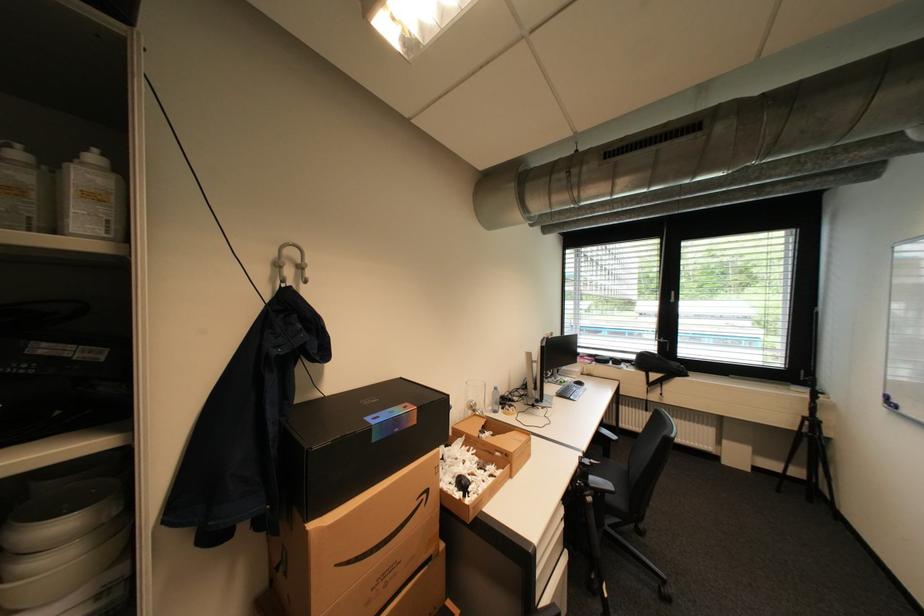
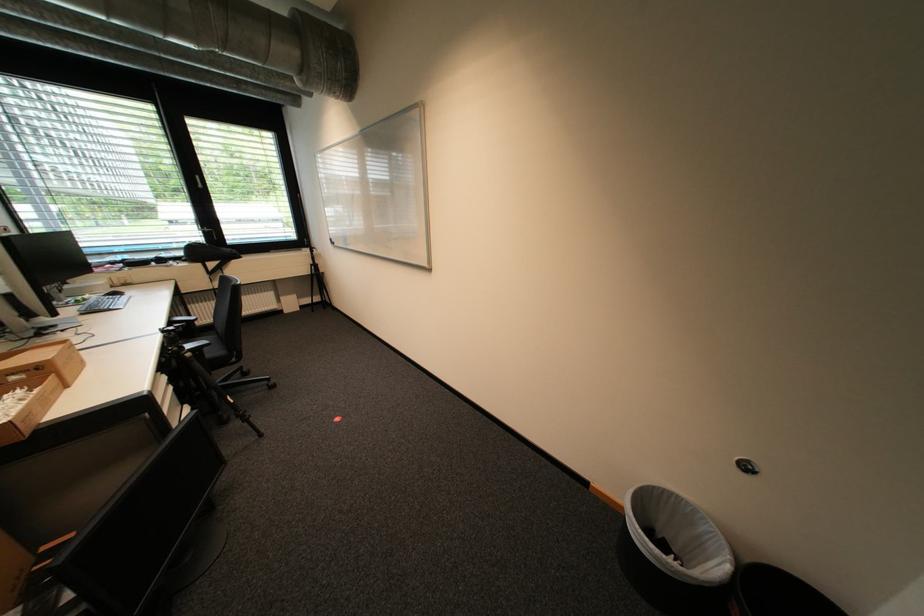
First-person continuous shooting, in which direction is the camera rotating?

The camera rotated toward right-down.